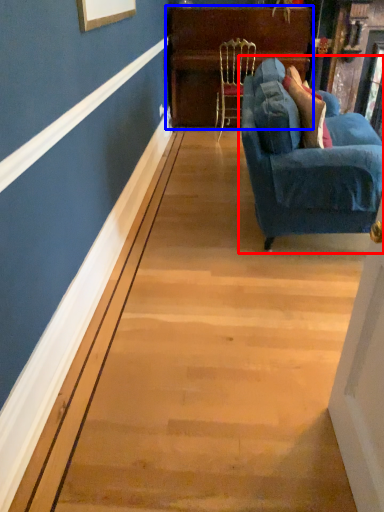
Question: Which object appears closest to the camera in this image, studio couch (highlighted by a red box) or dresser (highlighted by a blue box)?

Choices:
 (A) studio couch
 (B) dresser

Answer: (A)